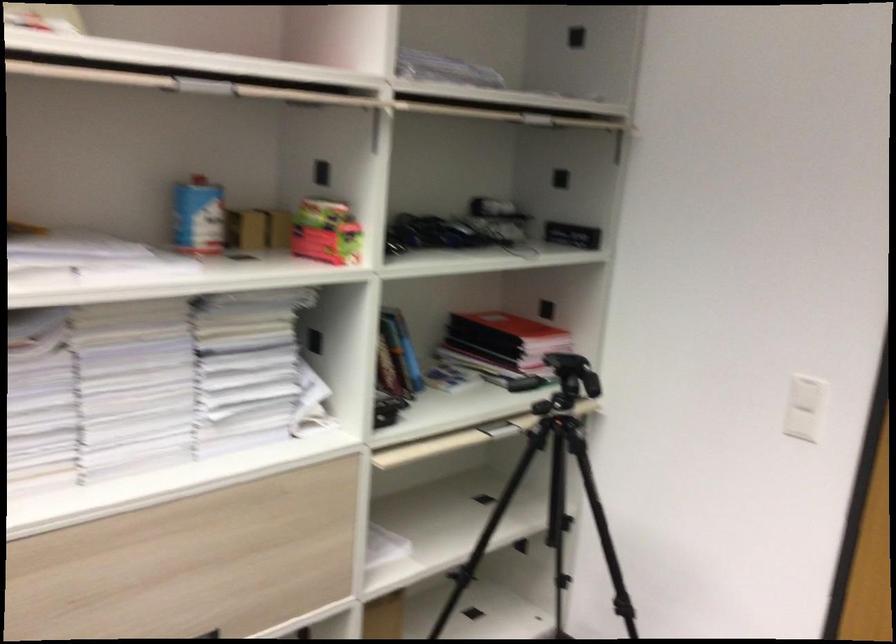
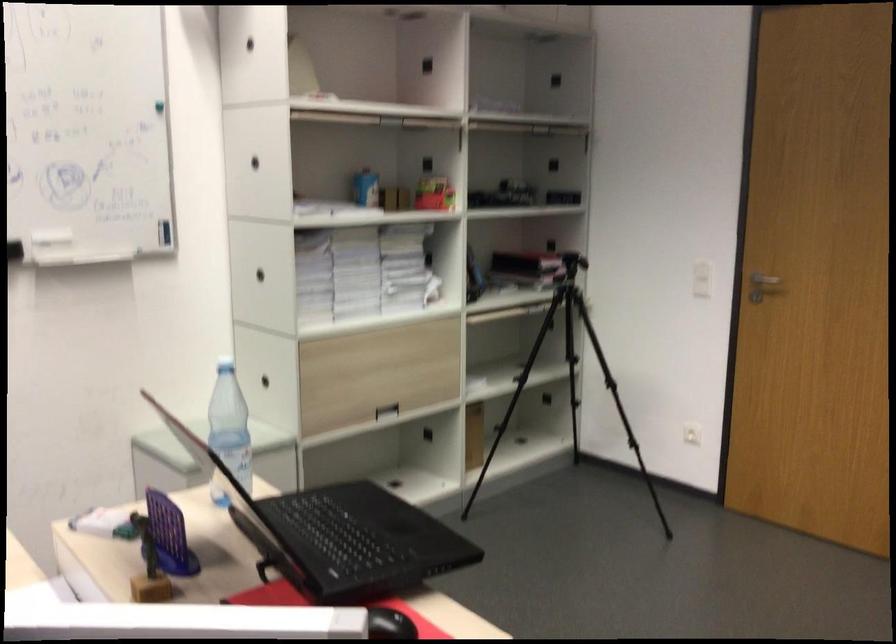
Question: In a continuous first-person perspective shot, in which direction is the camera moving?

Choices:
 (A) Left
 (B) Right
 (C) Forward
 (D) Backward

Answer: (D)